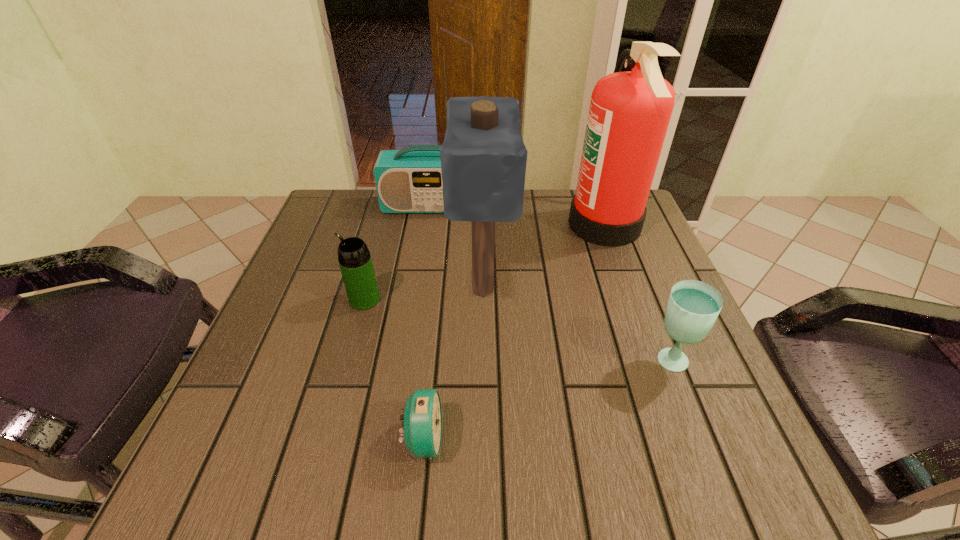
You are a GUI agent. You are given a task and a screenshot of the screen. Output one action in this format:
    pyautogui.click(x=<x>, y=<y>)
    Task: Click on the fire extinguisher
    This screenshot has height=540, width=960.
    Given the screenshot: What is the action you would take?
    pyautogui.click(x=629, y=113)

At what (x,y) coordinates should I click in order to perform the action: click on mallet. Please return your answer as a coordinate pair (x, y). The height and width of the screenshot is (540, 960). Looking at the image, I should click on (483, 157).

Locate an element on the screen. This screenshot has height=540, width=960. radio receiver is located at coordinates (409, 180).

Image resolution: width=960 pixels, height=540 pixels. In order to click on thermos bottle in this screenshot , I will do `click(354, 258)`.

I want to click on the second nearest object, so click(x=693, y=306).

This screenshot has width=960, height=540. Identify the location of alarm clock. (422, 433).

Where is `the nearest object`? the nearest object is located at coordinates click(422, 433).

I want to click on vacant area located at the nozzle of the fire extinguisher, so click(x=550, y=225).

I want to click on vacant space located at the nozzle of the fire extinguisher, so click(x=500, y=225).

The height and width of the screenshot is (540, 960). What are the coordinates of `vacant area located at the nozzle of the fire extinguisher` in the screenshot? It's located at (440, 225).